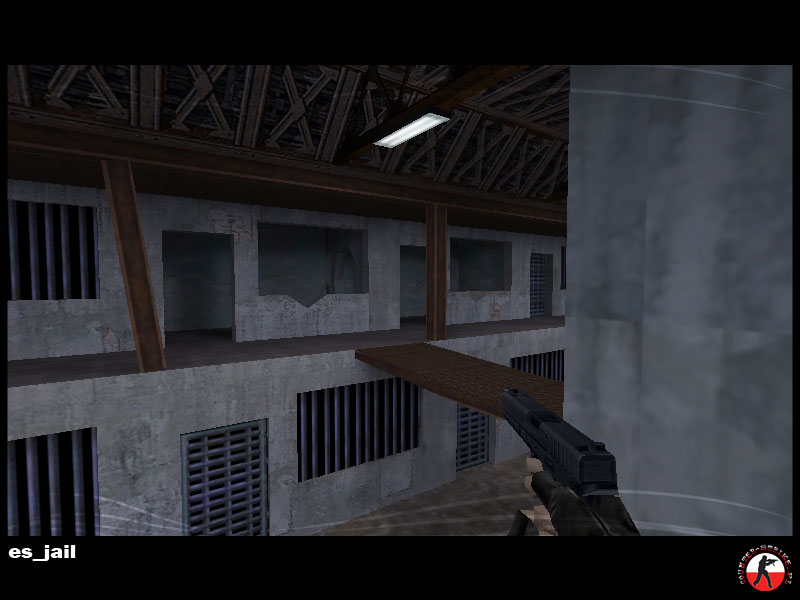
I want to click on open doorways, so click(x=200, y=311), click(x=405, y=284).